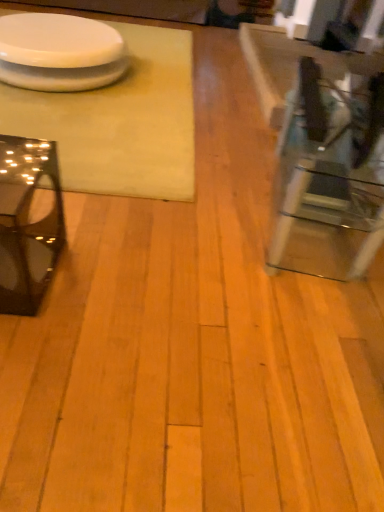
You are a GUI agent. You are given a task and a screenshot of the screen. Output one action in this format:
    pyautogui.click(x=<x>, y=<y>)
    Task: Click on the vacant space in front of white glossy platter at upper left
    The image size is (384, 512).
    Given the screenshot: What is the action you would take?
    pyautogui.click(x=72, y=126)